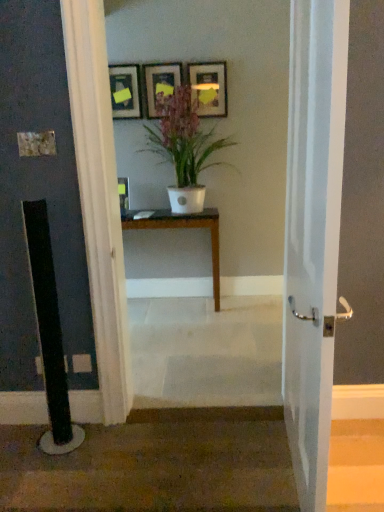
Locate an element on the screen. free space in front of wooden table at center is located at coordinates (181, 332).